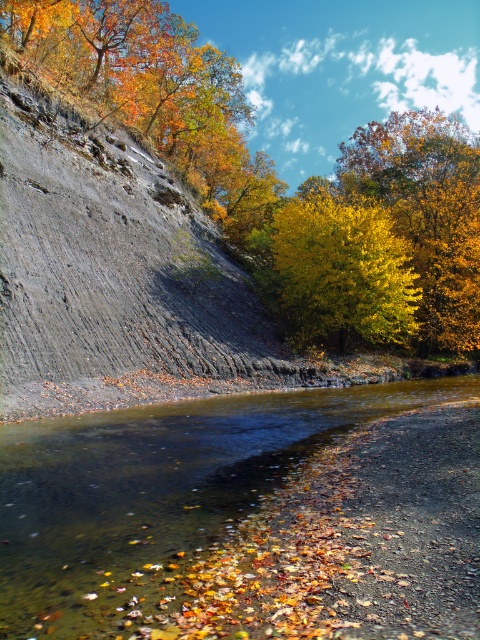
Between point (407, 189) and point (332, 221), which one is positioned behind?

The point (407, 189) is behind.

Where is `yellow/golden leaves at upper right`? yellow/golden leaves at upper right is located at coordinates (427, 212).

Locate an element on the screen. yellow/golden leaves at upper right is located at coordinates (427, 212).

Can you confirm if brown sedimentary rock at lower center is smaller than golden yellow leaves at upper center?

Correct, brown sedimentary rock at lower center occupies less space than golden yellow leaves at upper center.

Can you confirm if brown sedimentary rock at lower center is positioned to the left of golden yellow leaves at upper center?

Yes, brown sedimentary rock at lower center is to the left of golden yellow leaves at upper center.

Is point (441, 589) farther from viewer compared to point (425, 333)?

No, it is in front of (425, 333).

Where is `brown sedimentary rock at lower center`? brown sedimentary rock at lower center is located at coordinates (245, 516).

What are the coordinates of `brown sedimentary rock at lower center` in the screenshot? It's located at (245, 516).

Who is positioned more to the right, brown sedimentary rock at lower center or yellow leafy tree at center?

yellow leafy tree at center is more to the right.

Where is `brown sedimentary rock at lower center`? Image resolution: width=480 pixels, height=640 pixels. brown sedimentary rock at lower center is located at coordinates (245, 516).

In order to click on brown sedimentary rock at lower center in this screenshot , I will do `click(245, 516)`.